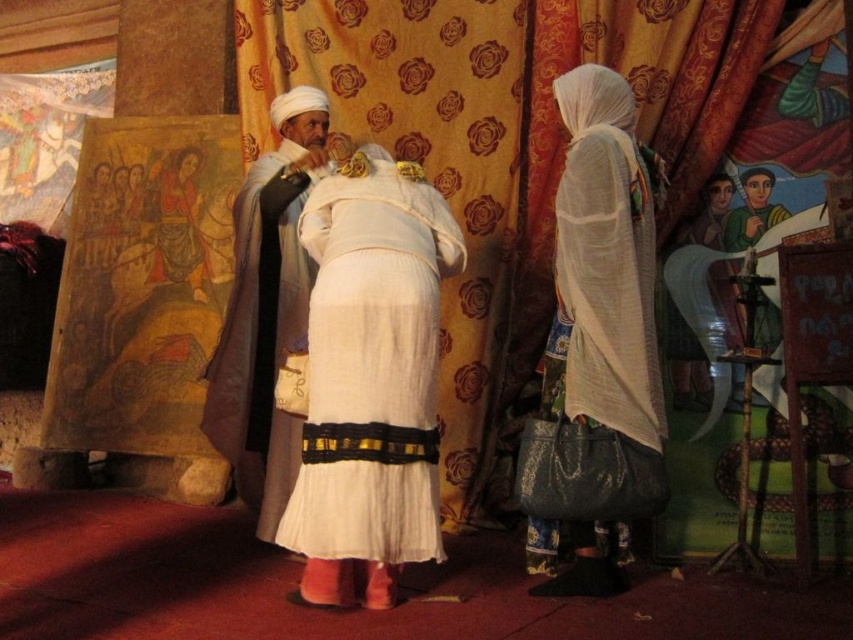
You are an event photographer at the ceremony. You need to capture a photo of both the matte white robe at center and the smooth white robe at center. Which one is positioned to the left of the other?

The matte white robe at center is to the left of smooth white robe at center.

You are standing at the origin of the coordinate system in this image. There are two points marked as point (531, 74) and point (601, 328). Which point is closer to you?

Point (531, 74) is behind point (601, 328), so the closer point to you is point (601, 328).

You are an event planner arranging seating for a ceremony. You need to ensure that the shorter object is placed in a front row so it can be seen. Which object should be placed in the front row between the white cotton dress at center and the white silk robe at center?

The white cotton dress at center should be placed in the front row because it is shorter than the white silk robe at center.